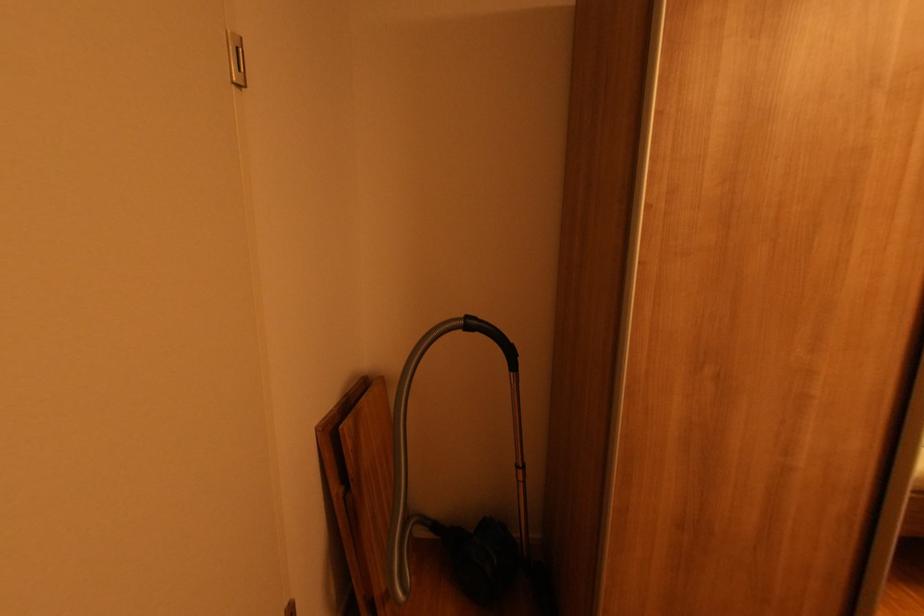
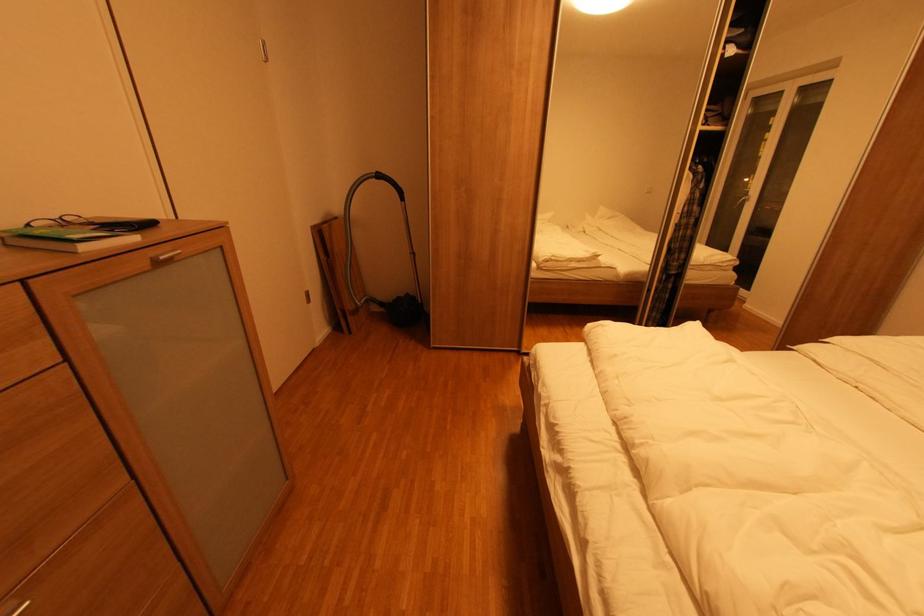
The point at (482, 334) is marked in the first image. Where is the corresponding point in the second image?

(387, 182)